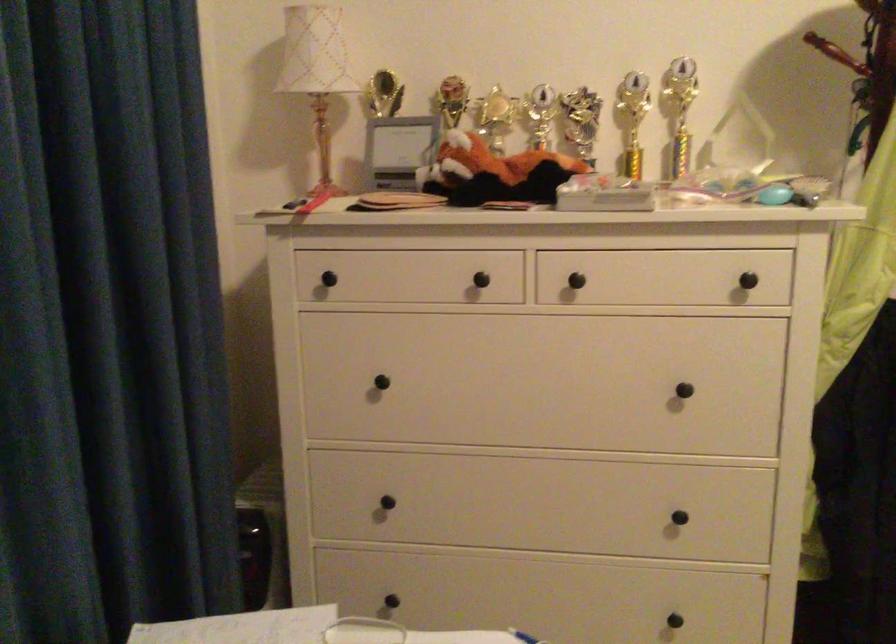
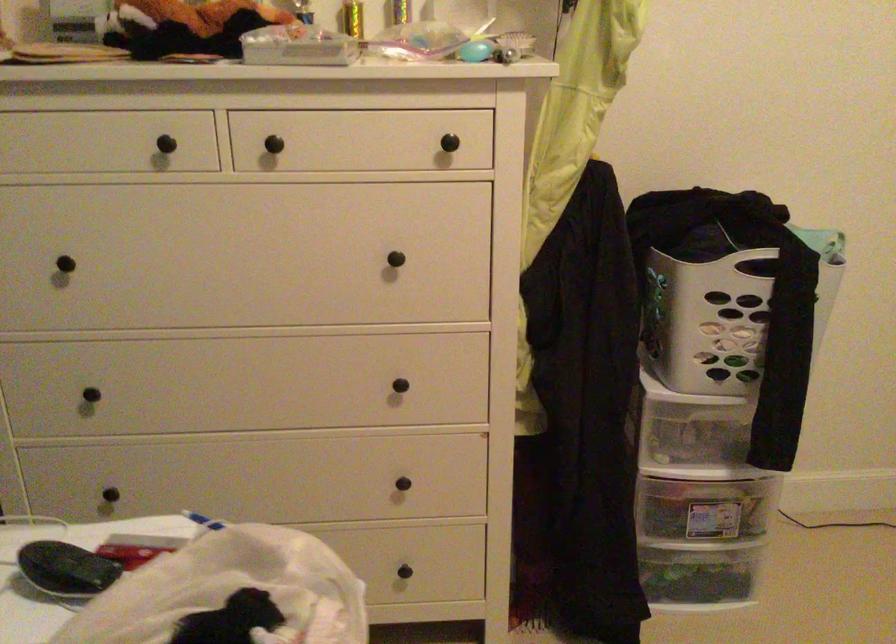
Question: The camera is either moving clockwise (left) or counter-clockwise (right) around the object. The first image is from the beginning of the video and the second image is from the end. Is the camera moving left or right when shooting the video?

Choices:
 (A) Left
 (B) Right

Answer: (A)